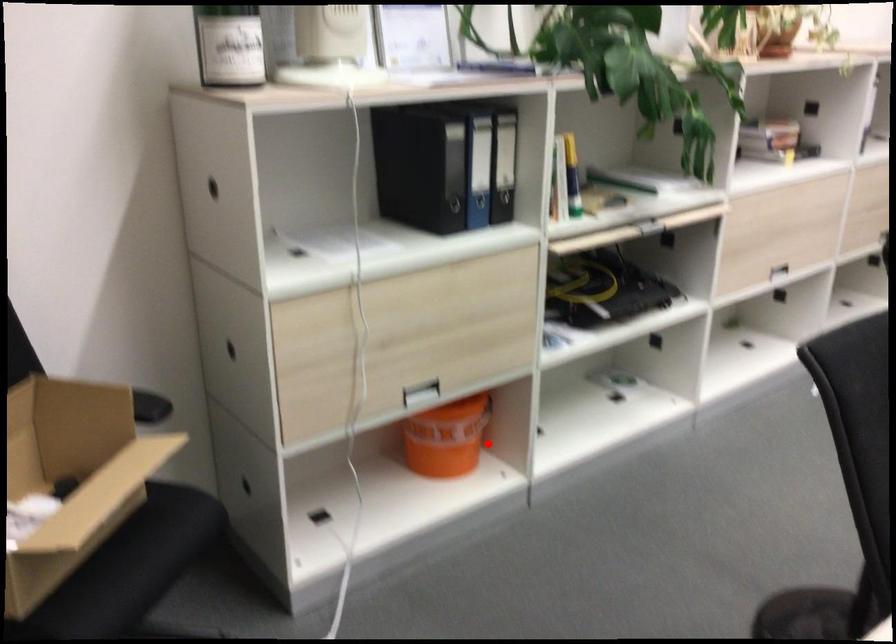
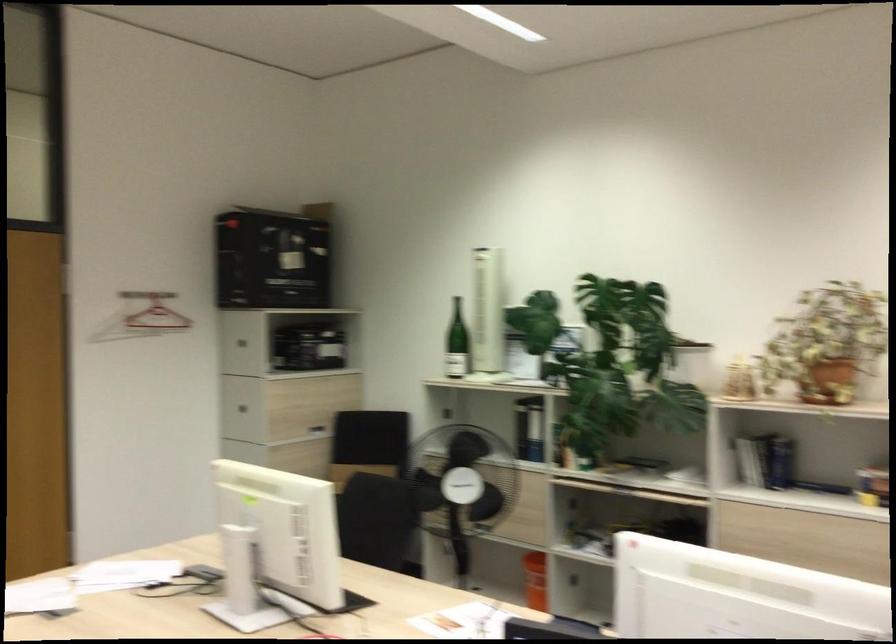
Question: I am providing you with two images of the same scene from different viewpoints. Image1 has a red point marked. In image2, the corresponding 3D location appears at what relative position? Reply with the corresponding letter.

Choices:
 (A) Closer
 (B) Farther

Answer: (B)